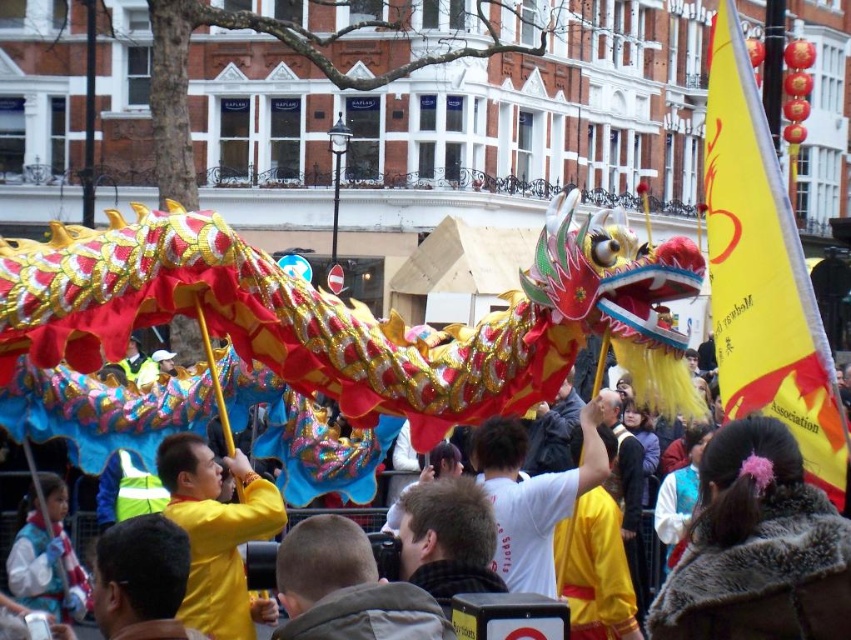
Question: Considering the relative positions of yellow paper flag at right and yellow fabric at center in the image provided, where is yellow paper flag at right located with respect to yellow fabric at center?

Choices:
 (A) above
 (B) below

Answer: (A)

Question: Which object appears closest to the camera in this image?

Choices:
 (A) yellow fabric dragon at center
 (B) fuzzy brown coat at center
 (C) yellow fabric headscarf at center

Answer: (B)

Question: Which object appears closest to the camera in this image?

Choices:
 (A) fuzzy brown coat at center
 (B) yellow paper flag at right
 (C) yellow fabric head at center
 (D) white fleece jacket at lower left

Answer: (C)

Question: Is yellow fabric at center smaller than yellow fabric headscarf at center?

Choices:
 (A) yes
 (B) no

Answer: (B)

Question: Which of the following is the farthest from the observer?

Choices:
 (A) [x=288, y=620]
 (B) [x=112, y=625]

Answer: (A)

Question: Is yellow fabric at center bigger than white fleece jacket at lower left?

Choices:
 (A) yes
 (B) no

Answer: (B)